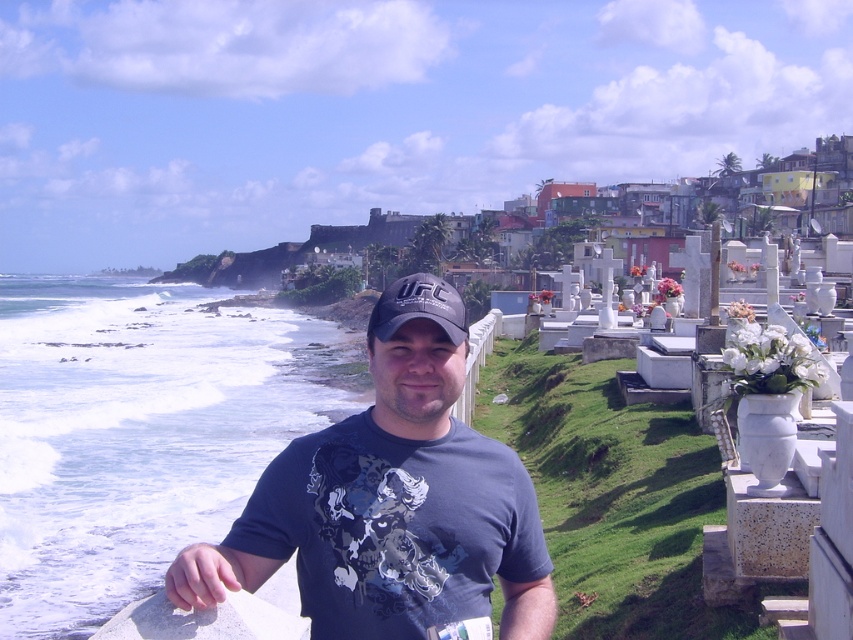
Is dark gray t-shirt at center to the right of black fabric cap at center from the viewer's perspective?

No, dark gray t-shirt at center is not to the right of black fabric cap at center.

Can you confirm if dark gray t-shirt at center is wider than black fabric cap at center?

Correct, the width of dark gray t-shirt at center exceeds that of black fabric cap at center.

Does point (445, 484) come farther from viewer compared to point (407, 298)?

No, (445, 484) is closer to viewer.

You are a GUI agent. You are given a task and a screenshot of the screen. Output one action in this format:
    pyautogui.click(x=<x>, y=<y>)
    Task: Click on the dark gray t-shirt at center
    The height and width of the screenshot is (640, 853).
    Given the screenshot: What is the action you would take?
    pyautogui.click(x=392, y=500)